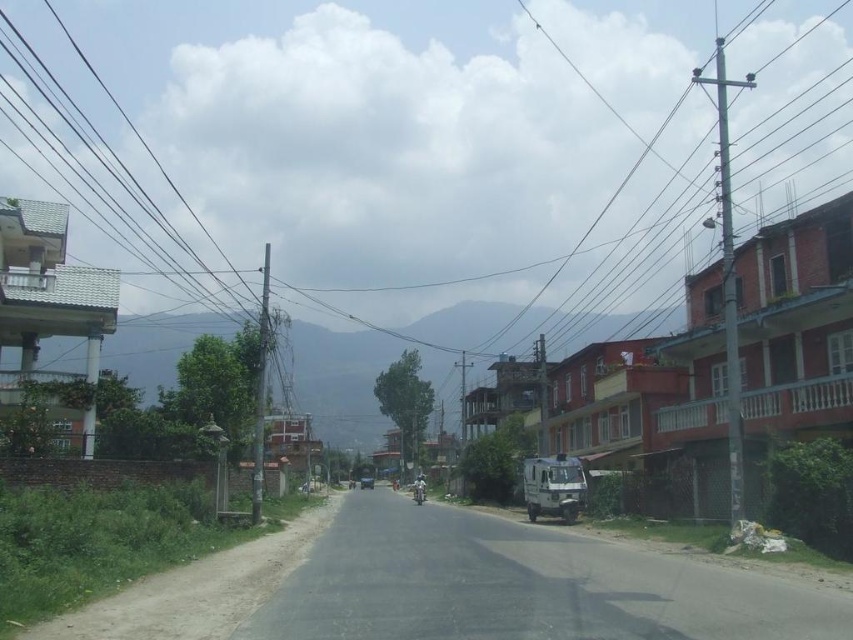
Question: Which object is closer to the camera taking this photo?

Choices:
 (A) metallic blue car at center
 (B) shiny chrome motorcycle at center

Answer: (B)

Question: Does shiny chrome motorcycle at center appear on the right side of metallic blue car at center?

Choices:
 (A) yes
 (B) no

Answer: (A)

Question: Is shiny chrome motorcycle at center closer to camera compared to metallic blue car at center?

Choices:
 (A) no
 (B) yes

Answer: (B)

Question: Observing the image, what is the correct spatial positioning of shiny chrome motorcycle at center in reference to metallic blue car at center?

Choices:
 (A) left
 (B) right

Answer: (B)